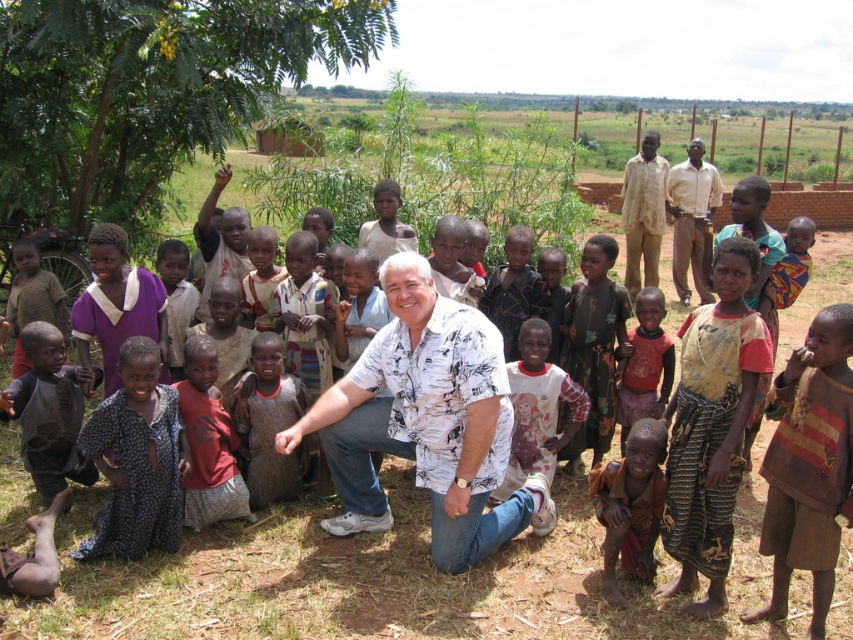
Question: Which object appears closest to the camera in this image?

Choices:
 (A) dark gray fabric shirt at lower left
 (B) reddish-brown fabric dress at lower center
 (C) printed cotton dress at lower left
 (D) light brown shirt at upper right

Answer: (C)

Question: Does printed cotton dress at lower left appear over reddish-brown fabric dress at lower center?

Choices:
 (A) yes
 (B) no

Answer: (B)

Question: Based on their relative distances, which object is nearer to the brown dirt field at center?

Choices:
 (A) light brown shirt at upper right
 (B) brown striped shirt at lower right
 (C) light brown fabric shirt at upper right
 (D) printed cotton dress at lower left

Answer: (D)

Question: Is the position of reddish-brown fabric dress at lower center more distant than that of light brown shirt at upper right?

Choices:
 (A) no
 (B) yes

Answer: (A)

Question: Which point is farther to the camera?

Choices:
 (A) white printed shirt at center
 (B) dark gray fabric shirt at lower left

Answer: (B)

Question: From the image, what is the correct spatial relationship of brown fabric at lower center in relation to red cotton shirt at lower left?

Choices:
 (A) below
 (B) above

Answer: (A)